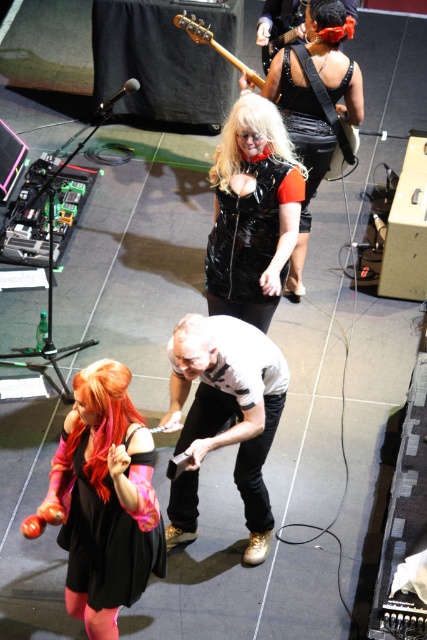
Does black satin dress at lower left appear on the right side of blondehair at center?

No, black satin dress at lower left is not to the right of blondehair at center.

How distant is black satin dress at lower left from blondehair at center?

7.54 feet

Who is more forward, (x=94, y=525) or (x=221, y=141)?

Point (x=94, y=525) is more forward.

This screenshot has width=427, height=640. I want to click on black satin dress at lower left, so click(111, 536).

Who is higher up, shiny black vest at center or blondehair at center?

shiny black vest at center

Where is `shiny black vest at center`? This screenshot has height=640, width=427. shiny black vest at center is located at coordinates (315, 104).

Who is more distant from viewer, (x=309, y=192) or (x=269, y=118)?

The point (x=309, y=192) is more distant.

The width and height of the screenshot is (427, 640). I want to click on shiny black vest at center, so click(315, 104).

Is white matte shirt at center positioned in front of black glossy guitar at upper center?

Yes, white matte shirt at center is in front of black glossy guitar at upper center.

Can you confirm if white matte shirt at center is taller than black glossy guitar at upper center?

Correct, white matte shirt at center is much taller as black glossy guitar at upper center.

Is point (251, 337) farther from camera compared to point (263, 81)?

No, it is not.

Locate an element on the screen. white matte shirt at center is located at coordinates (225, 417).